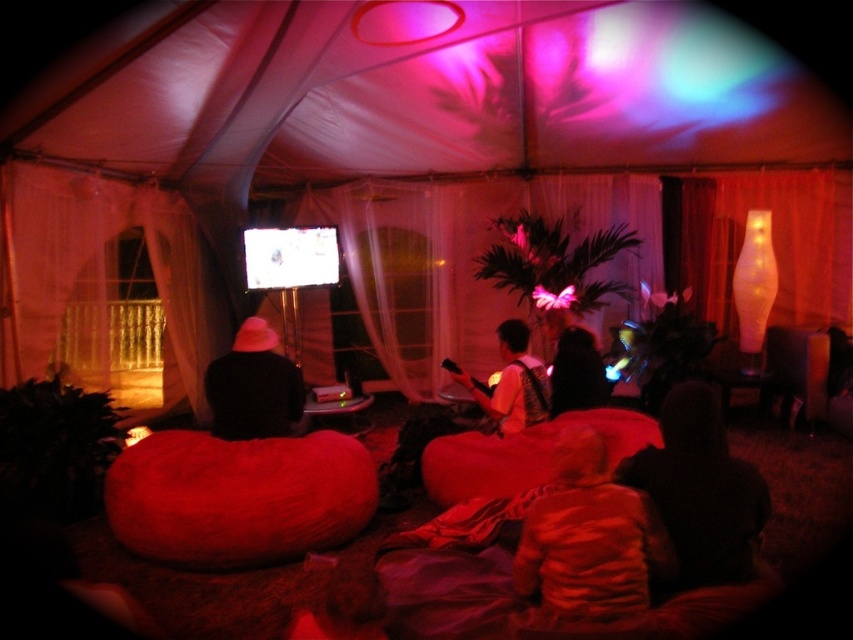
Is point (631, 525) positioned before point (711, 584)?

Yes, point (631, 525) is in front of point (711, 584).

Does velvet-like brown coat at lower center come behind dark fabric jacket at lower right?

No, velvet-like brown coat at lower center is in front of dark fabric jacket at lower right.

Is point (604, 541) in front of point (746, 524)?

Yes, it is.

Where is `velvet-like brown coat at lower center`? This screenshot has width=853, height=640. velvet-like brown coat at lower center is located at coordinates click(589, 538).

Measure the distance between velvet-like red bean bag at lower left and velvet-like brown coat at lower center.

1.46 meters

In the scene shown: Is velvet-like red bean bag at lower left to the right of velvet-like brown coat at lower center from the viewer's perspective?

No, velvet-like red bean bag at lower left is not to the right of velvet-like brown coat at lower center.

Does point (105, 480) lie in front of point (544, 552)?

That is False.

Where is `velvet-like red bean bag at lower left`? velvet-like red bean bag at lower left is located at coordinates (238, 497).

Can you confirm if dark fabric jacket at lower right is taller than silky black hair at center?

No.

Which is behind, point (688, 556) or point (596, 388)?

Point (596, 388)

You are a GUI agent. You are given a task and a screenshot of the screen. Output one action in this format:
    pyautogui.click(x=<x>, y=<y>)
    Task: Click on the dark fabric jacket at lower right
    This screenshot has height=640, width=853.
    Given the screenshot: What is the action you would take?
    pyautogui.click(x=700, y=490)